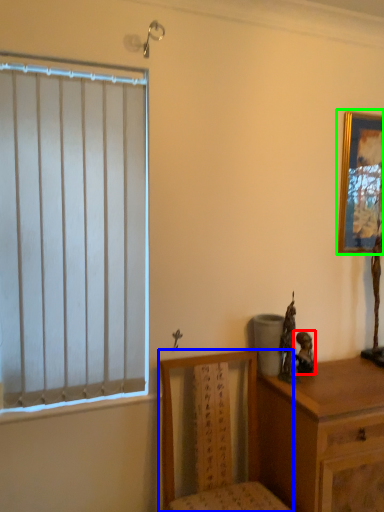
Question: Based on their relative distances, which object is farther from figurine (highlighted by a red box)? Choose from chair (highlighted by a blue box) and picture frame (highlighted by a green box).

Choices:
 (A) chair
 (B) picture frame

Answer: (B)